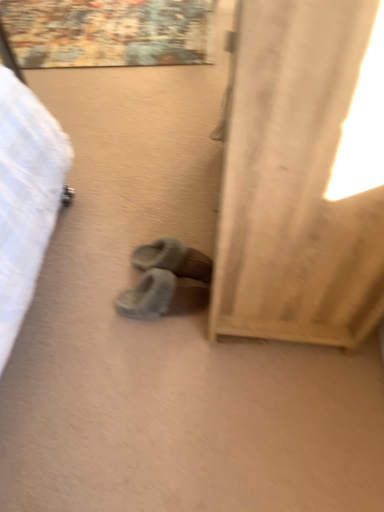
Question: Would you say beige fabric curtain at right is inside or outside gray fuzzy slippers at center, placed as the 1th footwear when sorted from top to bottom?

Choices:
 (A) outside
 (B) inside

Answer: (A)

Question: From a real-world perspective, relative to gray fuzzy slippers at center, placed as the 1th footwear when sorted from top to bottom, is beige fabric curtain at right vertically above or below?

Choices:
 (A) above
 (B) below

Answer: (A)

Question: Based on their relative distances, which object is farther from the gray fuzzy slippers at center, the 2th footwear from the bottom?

Choices:
 (A) beige fabric curtain at right
 (B) fuzzy suede slippers at center, the 1th footwear when ordered from bottom to top

Answer: (A)

Question: Which is farther from the gray fuzzy slippers at center, placed as the 1th footwear when sorted from top to bottom?

Choices:
 (A) beige fabric curtain at right
 (B) fuzzy suede slippers at center, the 1th footwear when ordered from bottom to top

Answer: (A)